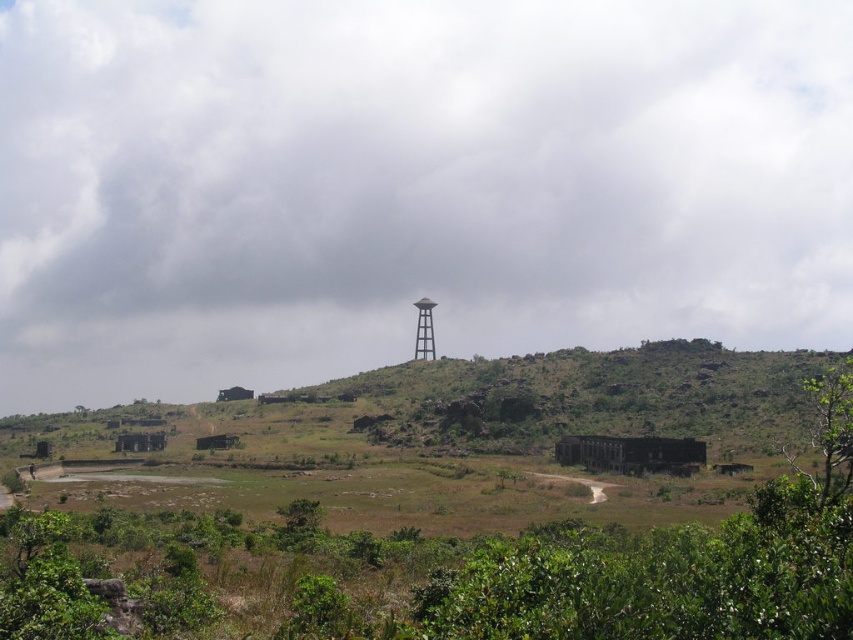
You are planning to set up a picnic blanket in the open landscape. You want to ensure there is enough space between the green leafy tree at lower right and the metallic gray observation tower at center so that the blanket doesn t get damaged by the tree s branches. Based on their widths, can you determine if there is sufficient space between them?

The green leafy tree at lower right might be wider than metallic gray observation tower at center, so there might not be enough space between them to safely place the picnic blanket without risking damage from the tree s branches.

You are standing at point (428,356) and want to reach the tall tower on the hill in the background. There is an obstacle at point (844,385). Will you be able to see the tower from your current position?

Since point (844,385) is in front of point (428,356), the obstacle at point (844,385) will block your view of the tower on the hill in the background.